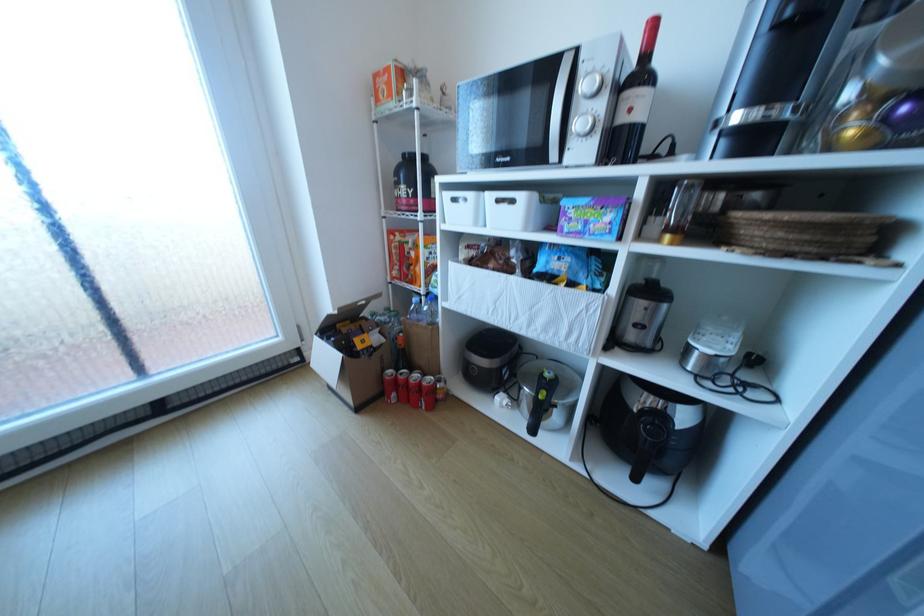
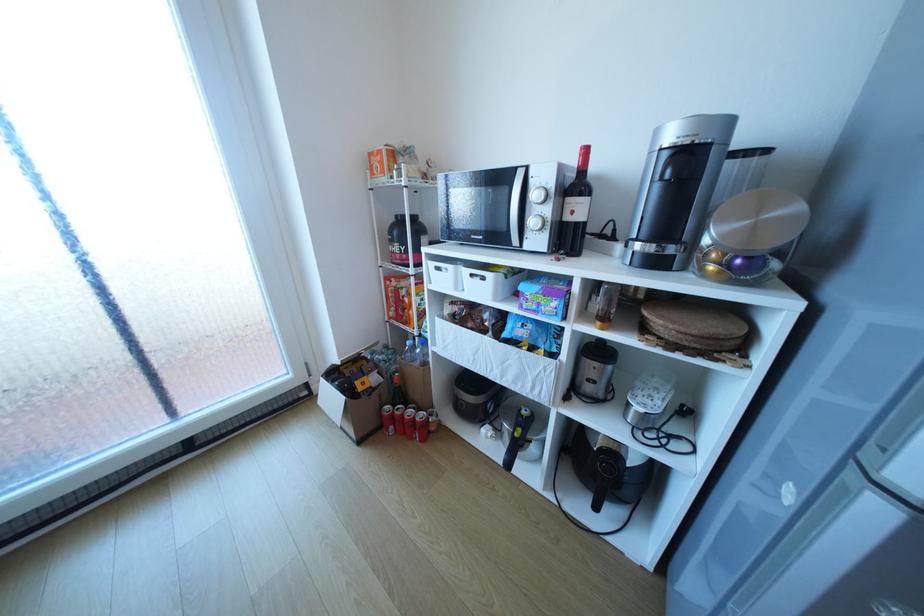
The point at [637,469] is marked in the first image. Where is the corresponding point in the second image?

(599, 499)